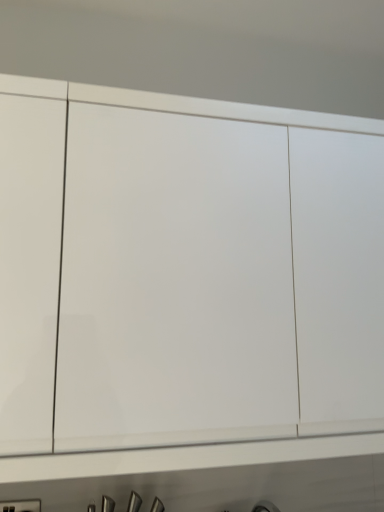
In order to face white plastic electric outlet at lower left, should I rotate leftwards or rightwards?

Turn left by 23.092 degrees to look at white plastic electric outlet at lower left.

Where is `white plastic electric outlet at lower left`? Image resolution: width=384 pixels, height=512 pixels. white plastic electric outlet at lower left is located at coordinates (21, 506).

Describe the element at coordinates (21, 506) in the screenshot. I see `white plastic electric outlet at lower left` at that location.

Locate an element on the screen. Image resolution: width=384 pixels, height=512 pixels. white plastic electric outlet at lower left is located at coordinates (21, 506).